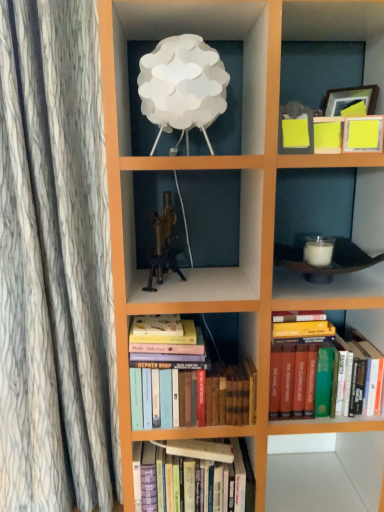
Question: Is hardcover books at lower right, the 1th book in the top-to-bottom sequence, a part of brass metallic tripod at center?

Choices:
 (A) no
 (B) yes

Answer: (A)

Question: Can you confirm if brass metallic tripod at center is positioned to the right of hardcover books at lower right, the 3th book ordered from the bottom?

Choices:
 (A) yes
 (B) no

Answer: (B)

Question: Is brass metallic tripod at center in front of hardcover books at lower right, the 1th book in the top-to-bottom sequence?

Choices:
 (A) yes
 (B) no

Answer: (A)

Question: From a real-world perspective, is brass metallic tripod at center located beneath hardcover books at lower right, the 3th book ordered from the bottom?

Choices:
 (A) no
 (B) yes

Answer: (A)

Question: Does brass metallic tripod at center have a larger size compared to hardcover books at lower right, the 3th book ordered from the bottom?

Choices:
 (A) yes
 (B) no

Answer: (B)

Question: Is brass metallic tripod at center turned away from hardcover books at lower right, the 1th book in the top-to-bottom sequence?

Choices:
 (A) no
 (B) yes

Answer: (A)

Question: From the image's perspective, does hardcover books at lower right, the 1th book in the top-to-bottom sequence, appear lower than hardcover books at center, the second book when ordered from top to bottom?

Choices:
 (A) no
 (B) yes

Answer: (A)

Question: Considering the relative sizes of hardcover books at lower right, the 3th book ordered from the bottom, and hardcover books at center, the second book in the bottom-to-top sequence, in the image provided, is hardcover books at lower right, the 3th book ordered from the bottom, shorter than hardcover books at center, the second book in the bottom-to-top sequence,?

Choices:
 (A) no
 (B) yes

Answer: (A)

Question: Can hardcover books at center, the second book in the bottom-to-top sequence, be found inside hardcover books at lower right, the 3th book ordered from the bottom?

Choices:
 (A) yes
 (B) no

Answer: (B)

Question: Could you tell me if hardcover books at lower right, the 3th book ordered from the bottom, is facing hardcover books at center, the second book in the bottom-to-top sequence?

Choices:
 (A) yes
 (B) no

Answer: (B)

Question: Considering the relative sizes of hardcover books at lower right, the 1th book in the top-to-bottom sequence, and hardcover books at center, the second book in the bottom-to-top sequence, in the image provided, is hardcover books at lower right, the 1th book in the top-to-bottom sequence, bigger than hardcover books at center, the second book in the bottom-to-top sequence,?

Choices:
 (A) yes
 (B) no

Answer: (A)

Question: From the image's perspective, is hardcover books at lower right, the 3th book ordered from the bottom, located above hardcover books at center, the second book when ordered from top to bottom?

Choices:
 (A) no
 (B) yes

Answer: (B)

Question: Is the position of white paper lampshade at upper center more distant than that of hardcover books at center, acting as the 3th book starting from the top?

Choices:
 (A) yes
 (B) no

Answer: (B)